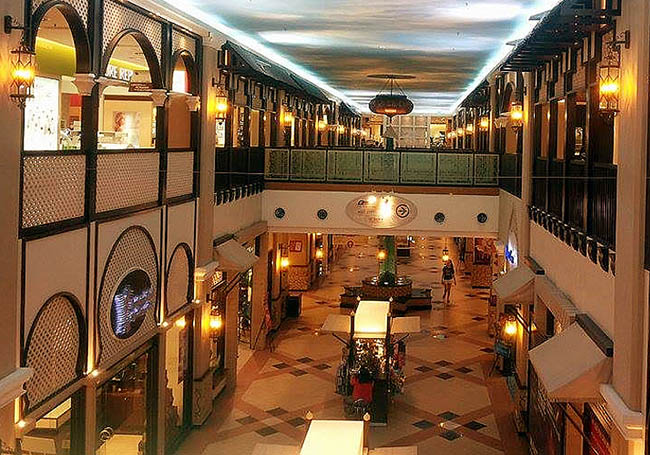
You are a GUI agent. You are given a task and a screenshot of the screen. Output one action in this format:
    pyautogui.click(x=<x>, y=<y>)
    Task: Click on the floor
    The image size is (650, 455).
    Given the screenshot: What is the action you would take?
    pyautogui.click(x=455, y=362)